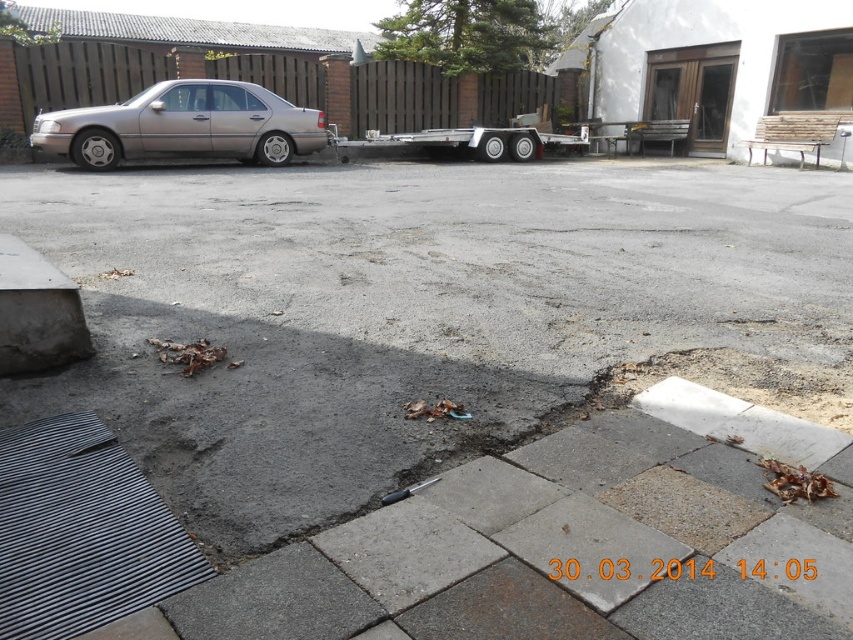
You are a delivery driver who needs to park your vehicle between the metallic gold car at left and the silver metallic trailer truck at center. Is there enough space for your vehicle which is 5 meters long?

The metallic gold car at left is to the left of the silver metallic trailer truck at center. The distance between them is not specified, so it is uncertain if there is enough space for a 5 meter long vehicle. Please check the actual distance before proceeding.

You are a delivery driver who needs to park your silver metallic trailer truck at center. There is a metallic gold car at left already parked. Can you estimate if your truck will fit in the available space without hitting the car?

The metallic gold car at left is smaller than silver metallic trailer truck at center. Since the truck is larger, it may not fit in the space allocated for the car. Please check the available space carefully before attempting to park.

Based on the photo, you are standing at the point labeled point (184, 125). Which object are you touching?

You are touching the metallic gold car at left because the point (184, 125) is located on it.